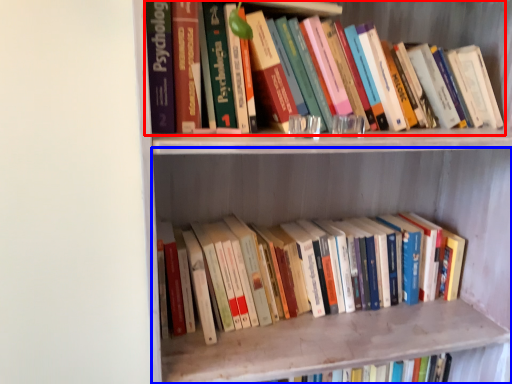
Question: Which of the following is the farthest to the observer, book (highlighted by a red box) or shelf (highlighted by a blue box)?

Choices:
 (A) book
 (B) shelf

Answer: (A)